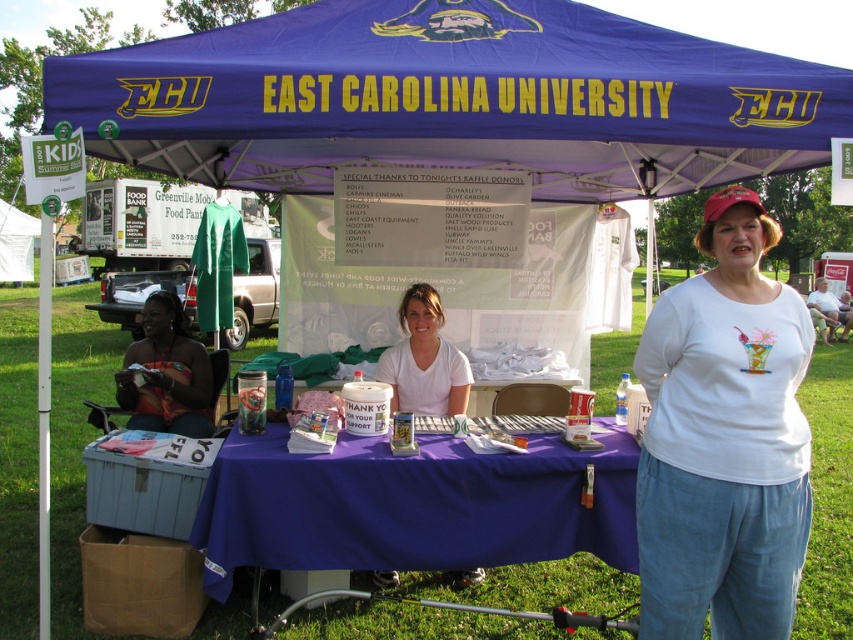
Question: Is purple fabric canopy at center further to camera compared to purple fabric table at center?

Choices:
 (A) no
 (B) yes

Answer: (B)

Question: Which point is farther to the camera?

Choices:
 (A) (827, 316)
 (B) (461, 401)
 (C) (119, 378)

Answer: (A)

Question: Can you confirm if white cotton t-shirt at center is positioned to the left of purple fabric table at center?

Choices:
 (A) yes
 (B) no

Answer: (B)

Question: Which of the following is the farthest from the observer?

Choices:
 (A) white cotton t-shirt at center
 (B) white matte t-shirt at center

Answer: (B)

Question: Which point is farther from the camera taking this photo?

Choices:
 (A) (419, 104)
 (B) (397, 316)
 (C) (755, 330)
 (D) (415, 540)

Answer: (B)

Question: Does white cotton t-shirt at center have a larger size compared to white matte t-shirt at center?

Choices:
 (A) yes
 (B) no

Answer: (B)